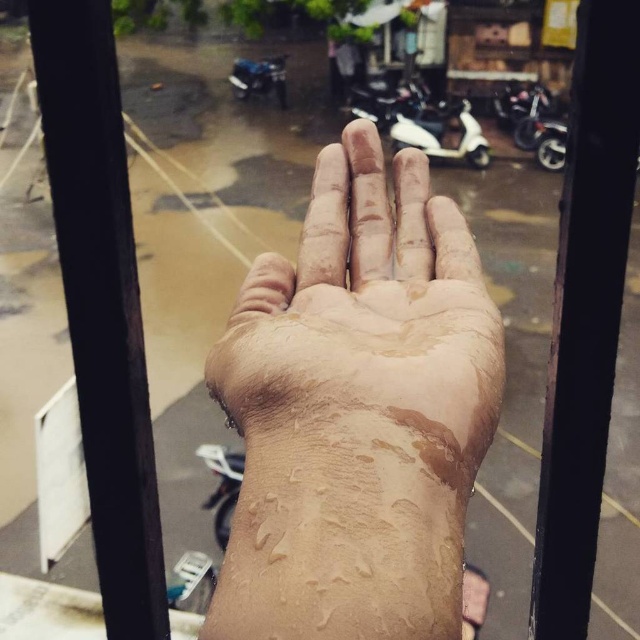
Question: Which object is positioned closest to the blue metallic motorcycle at upper center?

Choices:
 (A) white glossy scooter at center
 (B) dry skin at center

Answer: (A)

Question: Which is farther from the blue metallic motorcycle at upper center?

Choices:
 (A) dry skin at center
 (B) white glossy scooter at center

Answer: (A)

Question: Which point is closer to the camera?

Choices:
 (A) dry skin at center
 (B) blue metallic motorcycle at upper center
 (C) white glossy scooter at center

Answer: (A)

Question: Is dry skin at center positioned before blue metallic motorcycle at upper center?

Choices:
 (A) yes
 (B) no

Answer: (A)

Question: Is dry skin at center above white glossy scooter at center?

Choices:
 (A) no
 (B) yes

Answer: (A)

Question: Where is white glossy scooter at center located in relation to blue metallic motorcycle at upper center in the image?

Choices:
 (A) left
 (B) right

Answer: (B)